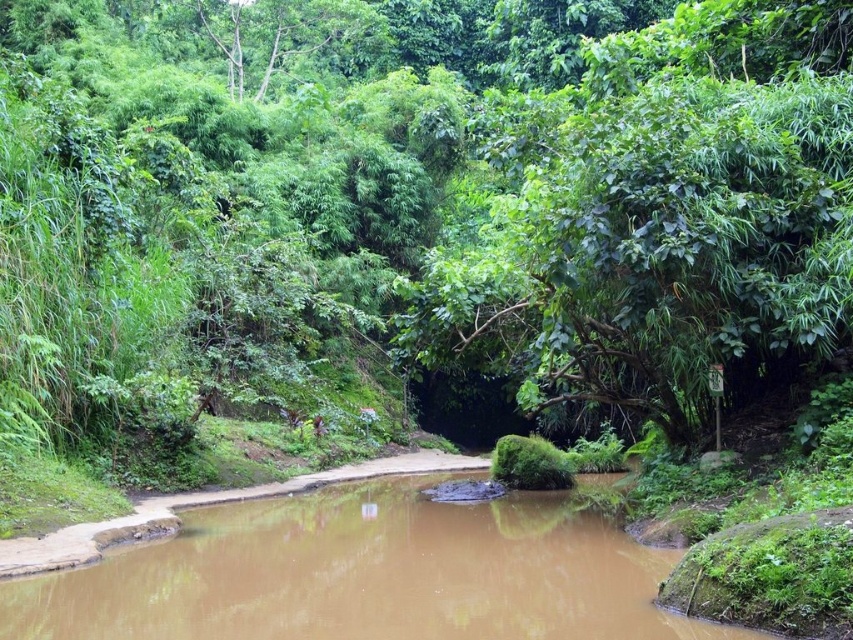
In the scene shown: Can you confirm if green leafy tree at center is positioned above brown muddy water at center?

Yes, green leafy tree at center is above brown muddy water at center.

Identify the location of green leafy tree at center. The height and width of the screenshot is (640, 853). (659, 216).

Locate an element on the screen. Image resolution: width=853 pixels, height=640 pixels. green leafy tree at center is located at coordinates (659, 216).